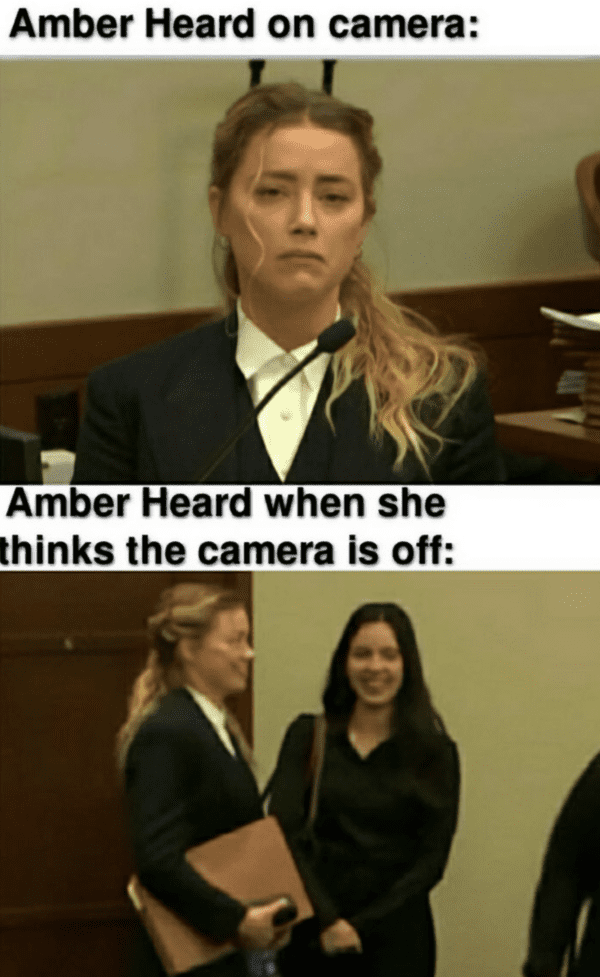
Find the location of a particular element. wall is located at coordinates (492, 692), (467, 161).